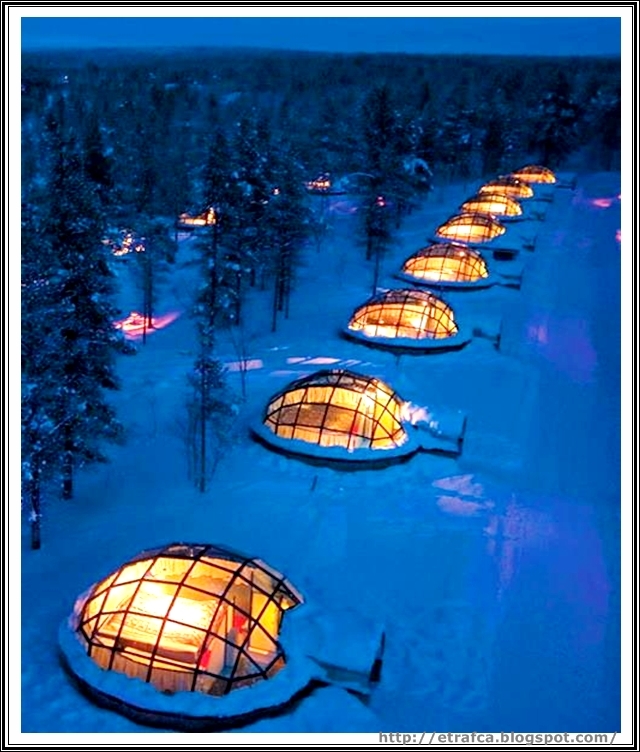
I want to click on light, so click(163, 608).